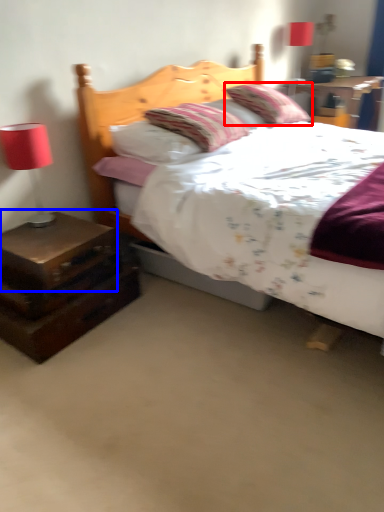
Question: Which object appears farthest to the camera in this image, pillow (highlighted by a red box) or nightstand (highlighted by a blue box)?

Choices:
 (A) pillow
 (B) nightstand

Answer: (A)